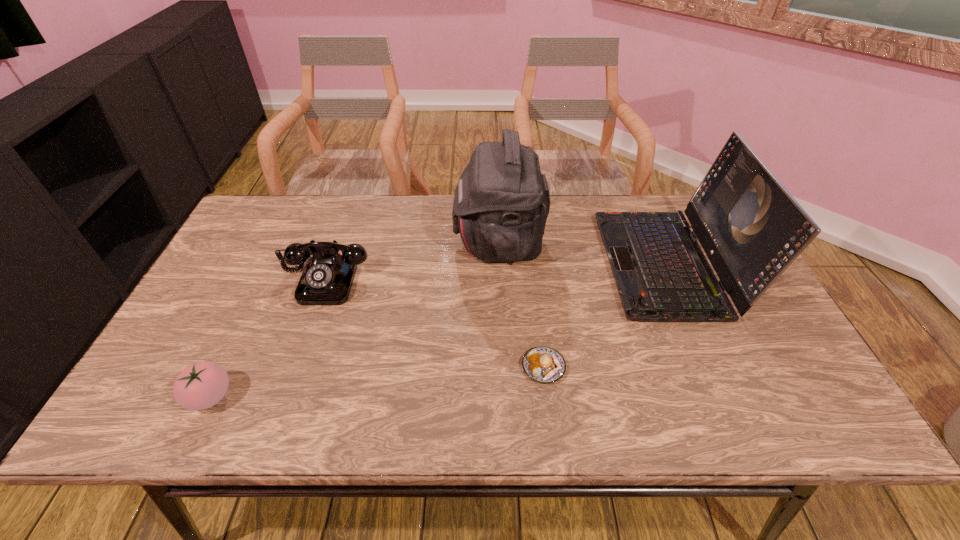
Locate an element on the screen. blank space that satisfies the following two spatial constraints: 1. on the open flap of the shoulder bag; 2. on the left side of the pastry is located at coordinates (504, 367).